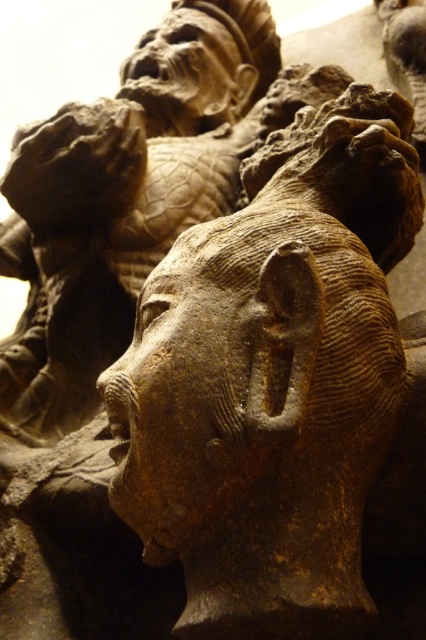
Between point (212, 372) and point (256, 77), which one is positioned behind?

The point (256, 77) is behind.

Looking at this image, does brown stone face at center have a smaller size compared to matte stone face at upper center?

Yes, brown stone face at center is smaller than matte stone face at upper center.

Is point (218, 394) farther from viewer compared to point (198, 49)?

No.

This screenshot has height=640, width=426. I want to click on brown stone face at center, so click(180, 401).